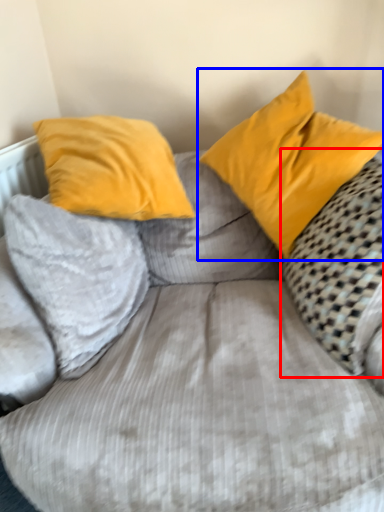
Question: Among these objects, which one is farthest to the camera, pillow (highlighted by a red box) or pillow (highlighted by a blue box)?

Choices:
 (A) pillow
 (B) pillow

Answer: (B)